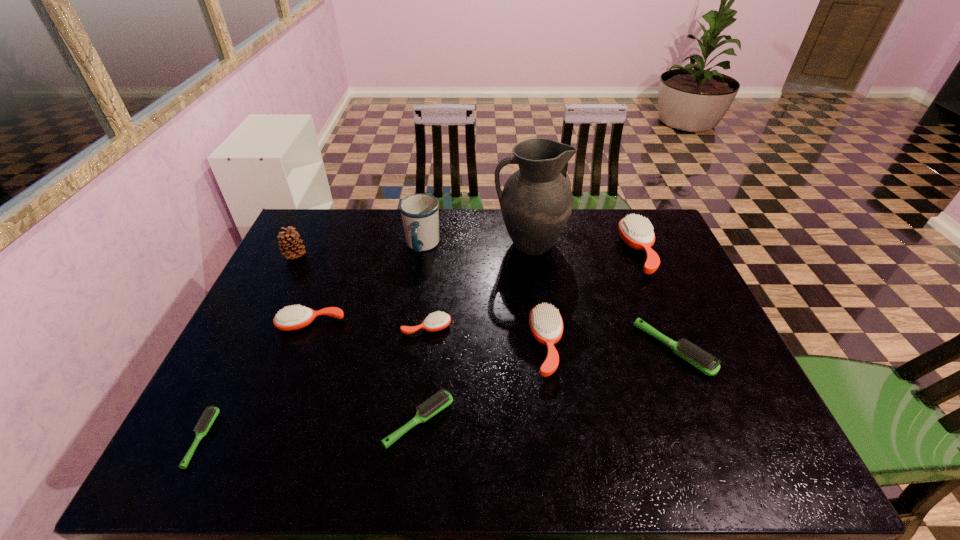
Locate an element on the screen. free spot at the near left corner of the desktop is located at coordinates (213, 436).

I want to click on free space at the near right corner of the desktop, so click(710, 440).

In order to click on empty location between the third orange hairbrush from right to left and the tallest hairbrush in this screenshot , I will do `click(533, 290)`.

Find the location of a particular element. free space between the tallest object and the shortest hairbrush is located at coordinates (366, 341).

I want to click on vacant space that's between the smallest orange hairbrush and the white mug, so click(x=424, y=287).

You are a GUI agent. You are given a task and a screenshot of the screen. Output one action in this format:
    pyautogui.click(x=<x>, y=<y>)
    Task: Click on the free area in between the sixth tallest hairbrush and the rightmost orange hairbrush
    The width and height of the screenshot is (960, 540).
    Given the screenshot: What is the action you would take?
    pyautogui.click(x=529, y=337)

I want to click on empty location between the sixth shortest object and the farthest light hairbrush, so click(611, 348).

Where is `vacant space in between the smallest light hairbrush and the sixth tallest hairbrush`? vacant space in between the smallest light hairbrush and the sixth tallest hairbrush is located at coordinates (310, 430).

Locate an element on the screen. The height and width of the screenshot is (540, 960). vacant space in between the leftmost hairbrush and the fifth shortest hairbrush is located at coordinates (256, 381).

Locate an element on the screen. The image size is (960, 540). vacant space that is in between the third tallest hairbrush and the ninth tallest object is located at coordinates (365, 373).